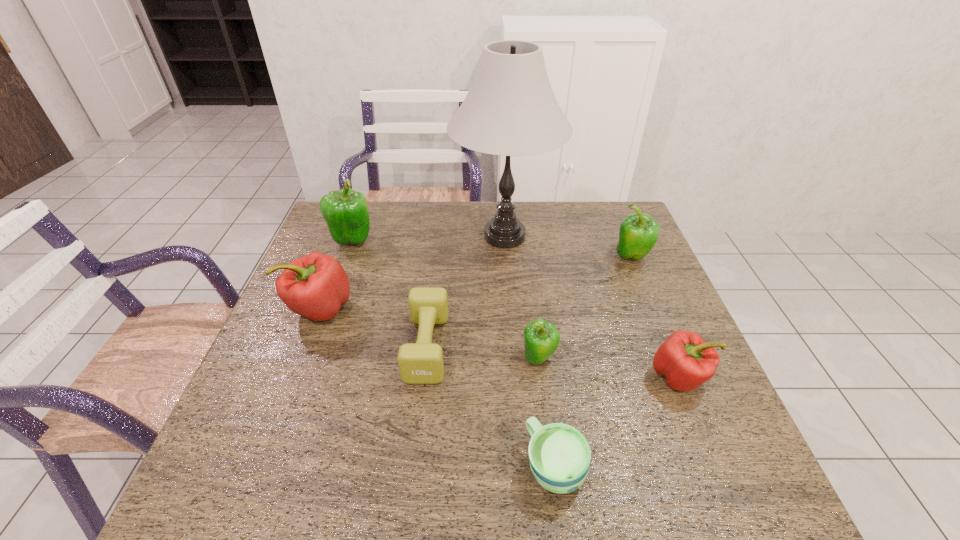
Identify the location of free region located on the left of the dumbbell. (292, 347).

Find the location of a particular element. This screenshot has height=540, width=960. free space located on the left of the cup is located at coordinates (326, 465).

What are the coordinates of `lamp at the far edge` in the screenshot? It's located at (510, 109).

You are a GUI agent. You are given a task and a screenshot of the screen. Output one action in this format:
    pyautogui.click(x=<x>, y=<y>)
    Task: Click on the bell pepper that is at the far edge
    This screenshot has height=540, width=960.
    Given the screenshot: What is the action you would take?
    pyautogui.click(x=346, y=212)

Where is `object located in the near edge section of the desktop`? The width and height of the screenshot is (960, 540). object located in the near edge section of the desktop is located at coordinates (559, 455).

This screenshot has height=540, width=960. What are the coordinates of `object that is positioned at the far left corner` in the screenshot? It's located at (346, 212).

The image size is (960, 540). Find the location of `free region at the far edge`. free region at the far edge is located at coordinates (414, 210).

Locate an element on the screen. The image size is (960, 540). free space at the near edge is located at coordinates (468, 480).

Locate an element on the screen. This screenshot has height=540, width=960. vacant space at the left edge of the desktop is located at coordinates (286, 407).

Identify the location of free space at the right edge. The height and width of the screenshot is (540, 960). (666, 296).